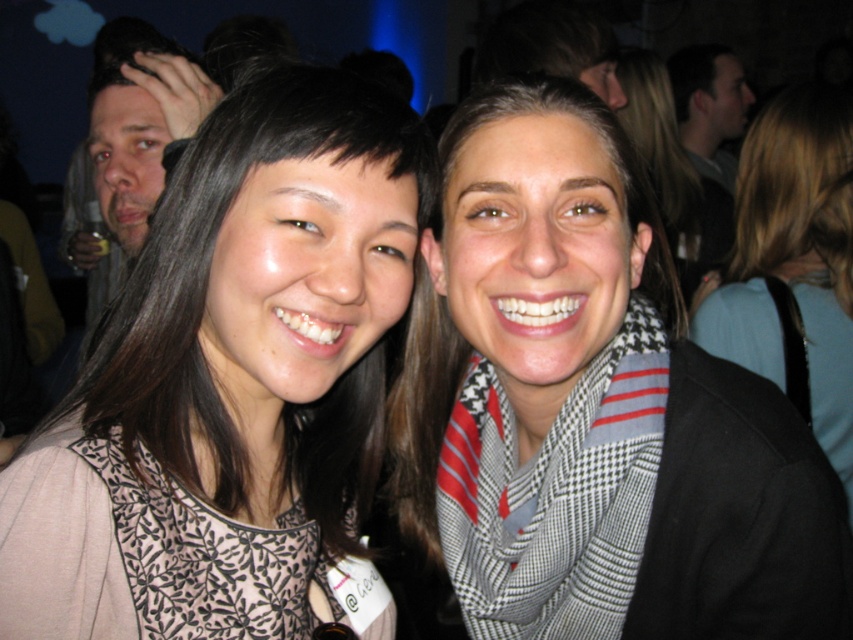
Question: Which point is closer to the camera?

Choices:
 (A) matte black hair at left
 (B) matte gray scarf at center

Answer: (A)

Question: Among these objects, which one is farthest from the camera?

Choices:
 (A) dark hair at upper right
 (B) matte floral dress at center
 (C) white and black checkered scarf at center
 (D) light blue scarf at center

Answer: (A)

Question: Can you confirm if white and black checkered scarf at center is smaller than matte gray scarf at center?

Choices:
 (A) no
 (B) yes

Answer: (B)

Question: Based on their relative distances, which object is nearer to the dark hair at upper right?

Choices:
 (A) matte gray scarf at center
 (B) white and black checkered scarf at center

Answer: (A)

Question: Is light blue scarf at center thinner than matte black hair at left?

Choices:
 (A) yes
 (B) no

Answer: (A)

Question: Can you confirm if white and black checkered scarf at center is thinner than matte black hair at left?

Choices:
 (A) yes
 (B) no

Answer: (A)